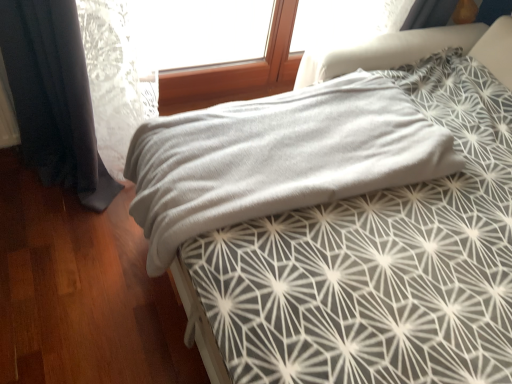
Question: Considering their positions, is gray soft fabric at center located in front of or behind gray soft fabric at center?

Choices:
 (A) behind
 (B) front

Answer: (A)

Question: From their relative heights in the image, would you say gray soft fabric at center is taller or shorter than gray soft fabric at center?

Choices:
 (A) tall
 (B) short

Answer: (B)

Question: Choose the correct answer: Is gray soft fabric at center inside gray soft fabric at center or outside it?

Choices:
 (A) outside
 (B) inside

Answer: (B)

Question: Considering the positions of point (442, 178) and point (365, 109), is point (442, 178) closer or farther from the camera than point (365, 109)?

Choices:
 (A) closer
 (B) farther

Answer: (A)

Question: Relative to gray soft fabric at center, is gray soft fabric at center in front or behind?

Choices:
 (A) behind
 (B) front

Answer: (B)

Question: From a real-world perspective, is gray soft fabric at center physically located above or below gray soft fabric at center?

Choices:
 (A) below
 (B) above

Answer: (B)

Question: In terms of size, does gray soft fabric at center appear bigger or smaller than gray soft fabric at center?

Choices:
 (A) small
 (B) big

Answer: (B)